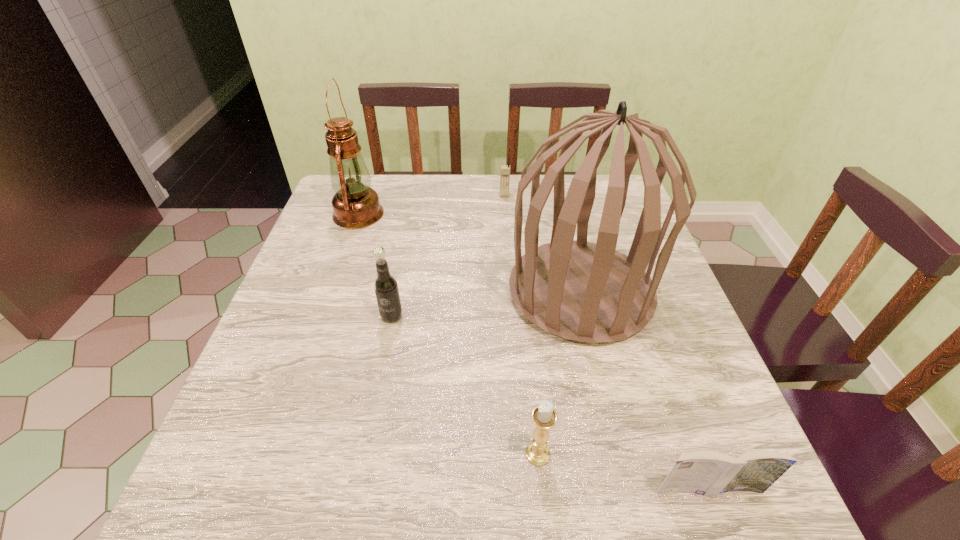
Point out which object is positioned as the nearest to the cellular telephone. Please provide its 2D coordinates. Your answer should be formatted as a tuple, i.e. [(x, y)], where the tuple contains the x and y coordinates of a point satisfying the conditions above.

[(589, 292)]

The image size is (960, 540). Find the location of `vacant space that satisfies the following two spatial constraints: 1. on the front of the cellular telephone, where the keypad is located; 2. on the left side of the birdcage`. vacant space that satisfies the following two spatial constraints: 1. on the front of the cellular telephone, where the keypad is located; 2. on the left side of the birdcage is located at coordinates (512, 292).

Find the location of a particular element. vacant space that satisfies the following two spatial constraints: 1. on the back side of the second nearest object; 2. on the right side of the birdcage is located at coordinates (522, 292).

This screenshot has height=540, width=960. Identify the location of free region that satisfies the following two spatial constraints: 1. on the front of the cellular telephone, where the keypad is located; 2. on the right side of the birdcage. (512, 292).